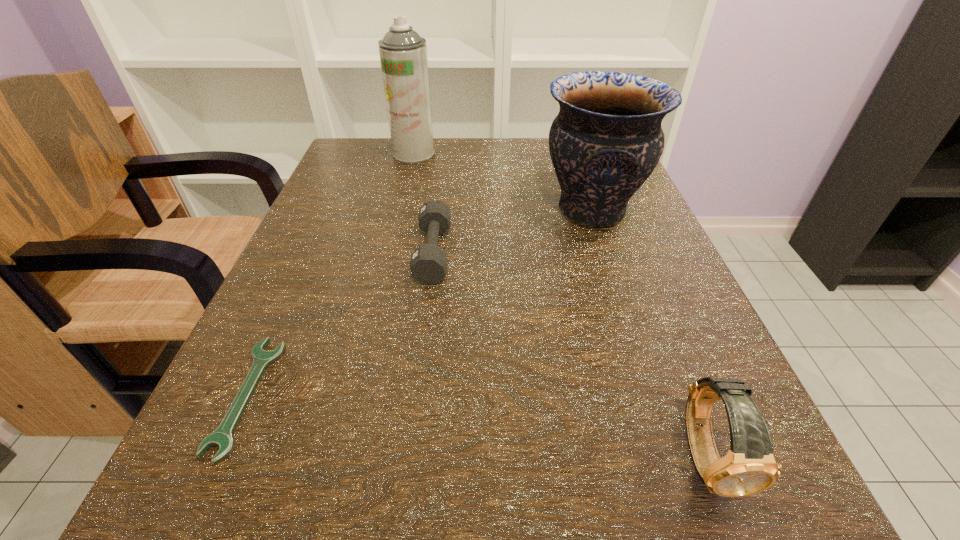
Find the location of `watch that is at the right edge`. watch that is at the right edge is located at coordinates (749, 467).

The image size is (960, 540). Find the location of `object that is at the far left corner`. object that is at the far left corner is located at coordinates (403, 53).

Image resolution: width=960 pixels, height=540 pixels. In order to click on object present at the near left corner in this screenshot , I will do `click(222, 437)`.

Image resolution: width=960 pixels, height=540 pixels. I want to click on object that is at the far right corner, so click(x=606, y=140).

Where is `object located in the near right corner section of the desktop`? object located in the near right corner section of the desktop is located at coordinates (749, 467).

Identify the location of free space at the far edge of the desktop. This screenshot has height=540, width=960. (442, 180).

Find the location of a particular element. The width and height of the screenshot is (960, 540). vacant space at the near edge of the desktop is located at coordinates (454, 523).

At what (x,y) coordinates should I click in order to perform the action: click on vacant region at the left edge of the desktop. Please return your answer as a coordinate pair (x, y). The image size is (960, 540). Looking at the image, I should click on (344, 403).

This screenshot has height=540, width=960. In order to click on vacant space at the right edge of the desktop in this screenshot , I will do `click(669, 280)`.

Where is `vacant space at the far left corner of the desktop`? The image size is (960, 540). vacant space at the far left corner of the desktop is located at coordinates (335, 176).